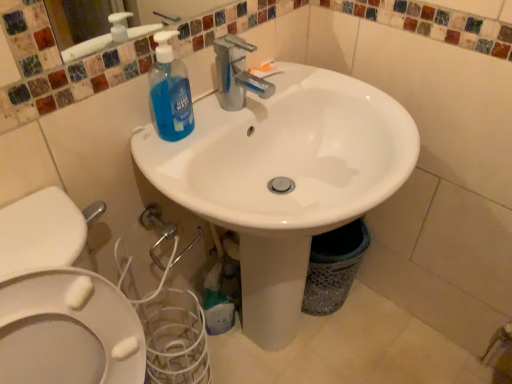
Question: Is blue translucent liquid soap at upper left, placed as the 2th cleaning product when sorted from back to front, located within translucent plastic bottle at lower center, acting as the 2th cleaning product starting from the top?

Choices:
 (A) yes
 (B) no

Answer: (B)

Question: Considering the relative sizes of translucent plastic bottle at lower center, arranged as the 1th cleaning product when viewed from the back, and blue translucent liquid soap at upper left, which ranks as the first cleaning product in front-to-back order, in the image provided, is translucent plastic bottle at lower center, arranged as the 1th cleaning product when viewed from the back, smaller than blue translucent liquid soap at upper left, which ranks as the first cleaning product in front-to-back order,?

Choices:
 (A) no
 (B) yes

Answer: (A)

Question: Considering the relative positions of translucent plastic bottle at lower center, positioned as the 2th cleaning product in front-to-back order, and blue translucent liquid soap at upper left, placed as the 2th cleaning product when sorted from back to front, in the image provided, is translucent plastic bottle at lower center, positioned as the 2th cleaning product in front-to-back order, to the left of blue translucent liquid soap at upper left, placed as the 2th cleaning product when sorted from back to front, from the viewer's perspective?

Choices:
 (A) no
 (B) yes

Answer: (A)

Question: Is translucent plastic bottle at lower center, the first cleaning product when ordered from bottom to top, in front of blue translucent liquid soap at upper left, positioned as the first cleaning product in top-to-bottom order?

Choices:
 (A) yes
 (B) no

Answer: (B)

Question: Is translucent plastic bottle at lower center, the first cleaning product when ordered from bottom to top, wider than blue translucent liquid soap at upper left, the 2th cleaning product ordered from the bottom?

Choices:
 (A) no
 (B) yes

Answer: (B)

Question: Is white glossy sink at center to the left or to the right of blue translucent liquid soap at upper left, the 2th cleaning product ordered from the bottom, in the image?

Choices:
 (A) left
 (B) right

Answer: (B)

Question: From the image's perspective, is white glossy sink at center positioned above or below blue translucent liquid soap at upper left, the 2th cleaning product ordered from the bottom?

Choices:
 (A) below
 (B) above

Answer: (A)

Question: In terms of width, does white glossy sink at center look wider or thinner when compared to blue translucent liquid soap at upper left, which ranks as the first cleaning product in front-to-back order?

Choices:
 (A) wide
 (B) thin

Answer: (A)

Question: From a real-world perspective, is white glossy sink at center above or below blue translucent liquid soap at upper left, positioned as the first cleaning product in top-to-bottom order?

Choices:
 (A) below
 (B) above

Answer: (A)

Question: In terms of height, does blue translucent liquid soap at upper left, positioned as the first cleaning product in top-to-bottom order, look taller or shorter compared to white glossy sink at center?

Choices:
 (A) short
 (B) tall

Answer: (A)

Question: Do you think blue translucent liquid soap at upper left, placed as the 2th cleaning product when sorted from back to front, is within white glossy sink at center, or outside of it?

Choices:
 (A) inside
 (B) outside

Answer: (A)

Question: From a real-world perspective, relative to white glossy sink at center, is blue translucent liquid soap at upper left, the 2th cleaning product ordered from the bottom, vertically above or below?

Choices:
 (A) below
 (B) above

Answer: (B)

Question: Based on their positions, is blue translucent liquid soap at upper left, positioned as the first cleaning product in top-to-bottom order, located to the left or right of white glossy sink at center?

Choices:
 (A) left
 (B) right

Answer: (A)

Question: Considering the positions of translucent plastic bottle at lower center, positioned as the 2th cleaning product in front-to-back order, and blue translucent liquid soap at upper left, positioned as the first cleaning product in top-to-bottom order, in the image, is translucent plastic bottle at lower center, positioned as the 2th cleaning product in front-to-back order, wider or thinner than blue translucent liquid soap at upper left, positioned as the first cleaning product in top-to-bottom order,?

Choices:
 (A) wide
 (B) thin

Answer: (A)

Question: From the image's perspective, is translucent plastic bottle at lower center, acting as the 2th cleaning product starting from the top, located above or below blue translucent liquid soap at upper left, the 2th cleaning product ordered from the bottom?

Choices:
 (A) below
 (B) above

Answer: (A)